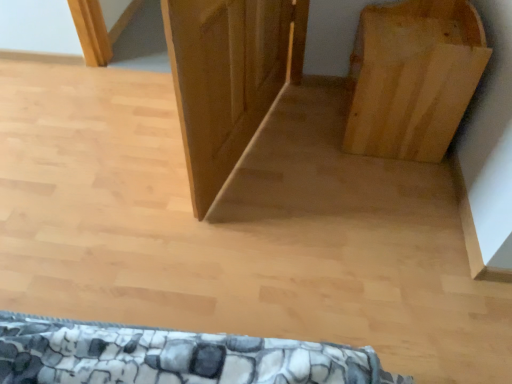
The image size is (512, 384). In order to click on free space in front of natural wood bookshelf at right in this screenshot , I will do `click(387, 189)`.